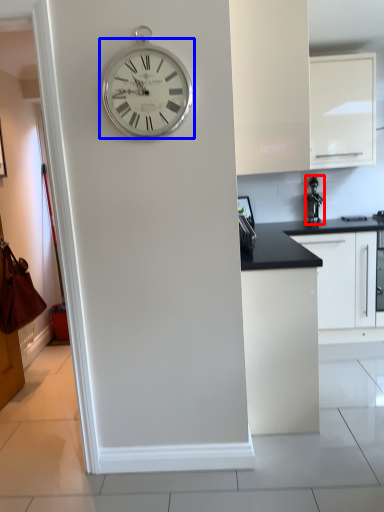
Question: Which of the following is the farthest to the observer, appliance (highlighted by a red box) or wall clock (highlighted by a blue box)?

Choices:
 (A) appliance
 (B) wall clock

Answer: (A)